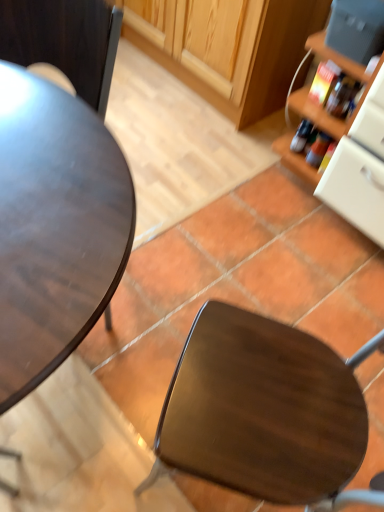
Question: Is shiny brown chair at center to the right of matte dark wood desk at left from the viewer's perspective?

Choices:
 (A) no
 (B) yes

Answer: (B)

Question: From a real-world perspective, is shiny brown chair at center below matte dark wood desk at left?

Choices:
 (A) no
 (B) yes

Answer: (B)

Question: Does shiny brown chair at center have a lesser height compared to matte dark wood desk at left?

Choices:
 (A) no
 (B) yes

Answer: (A)

Question: Is shiny brown chair at center next to matte dark wood desk at left and touching it?

Choices:
 (A) no
 (B) yes

Answer: (A)

Question: Considering the relative positions of shiny brown chair at center and matte dark wood desk at left in the image provided, is shiny brown chair at center to the left of matte dark wood desk at left from the viewer's perspective?

Choices:
 (A) yes
 (B) no

Answer: (B)

Question: In terms of width, does matte dark wood desk at left look wider or thinner when compared to shiny brown chair at center?

Choices:
 (A) thin
 (B) wide

Answer: (A)

Question: Based on their sizes in the image, would you say matte dark wood desk at left is bigger or smaller than shiny brown chair at center?

Choices:
 (A) small
 (B) big

Answer: (B)

Question: Is matte dark wood desk at left inside the boundaries of shiny brown chair at center, or outside?

Choices:
 (A) outside
 (B) inside

Answer: (A)

Question: Would you say matte dark wood desk at left is to the left or to the right of shiny brown chair at center in the picture?

Choices:
 (A) right
 (B) left

Answer: (B)

Question: In terms of height, does matte dark wood desk at left look taller or shorter compared to matte gray toaster at upper right?

Choices:
 (A) tall
 (B) short

Answer: (A)

Question: Is matte dark wood desk at left wider or thinner than matte gray toaster at upper right?

Choices:
 (A) thin
 (B) wide

Answer: (B)

Question: Based on their positions, is matte dark wood desk at left located to the left or right of matte gray toaster at upper right?

Choices:
 (A) right
 (B) left

Answer: (B)

Question: Is matte dark wood desk at left inside or outside of matte gray toaster at upper right?

Choices:
 (A) inside
 (B) outside

Answer: (B)

Question: In terms of height, does matte dark wood desk at left look taller or shorter compared to translucent plastic bottle at right?

Choices:
 (A) short
 (B) tall

Answer: (B)

Question: From the image's perspective, relative to translucent plastic bottle at right, is matte dark wood desk at left above or below?

Choices:
 (A) below
 (B) above

Answer: (A)